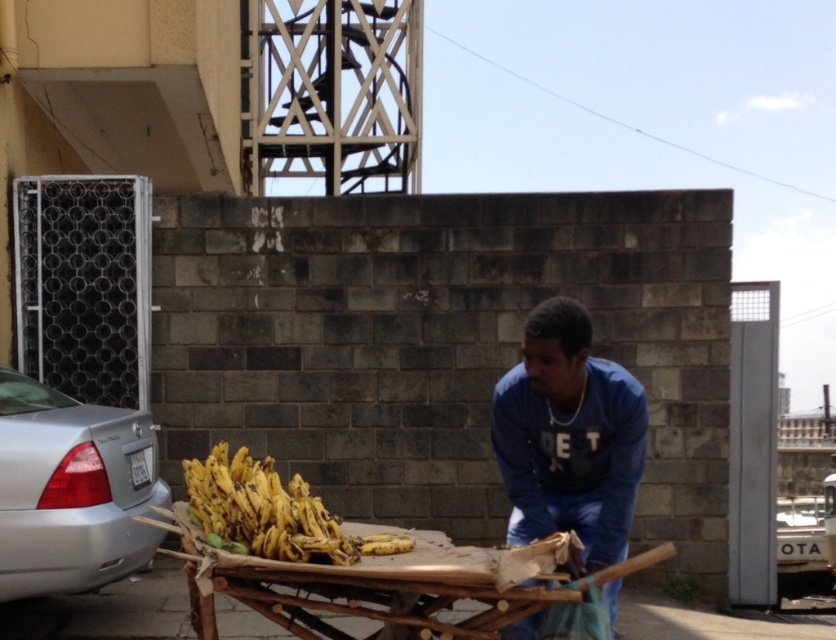
Can you confirm if silver metallic car at left is taller than yellow matte bananas at center?

Yes, silver metallic car at left is taller than yellow matte bananas at center.

Who is positioned more to the left, silver metallic car at left or yellow matte bananas at center?

silver metallic car at left is more to the left.

Which is behind, point (13, 435) or point (242, 532)?

Point (13, 435)

Where is `silver metallic car at left`? silver metallic car at left is located at coordinates (72, 490).

Does silver metallic car at left appear over wooden bamboo cart at center?

Yes, silver metallic car at left is above wooden bamboo cart at center.

Can you confirm if silver metallic car at left is thinner than wooden bamboo cart at center?

Yes.

Between point (83, 440) and point (427, 552), which one is positioned behind?

The point (83, 440) is more distant.

At what (x,y) coordinates should I click in order to perform the action: click on silver metallic car at left. Please return your answer as a coordinate pair (x, y). This screenshot has height=640, width=836. Looking at the image, I should click on (72, 490).

Based on the photo, is blue cotton shirt at center to the left of yellow matte bananas at lower center from the viewer's perspective?

No, blue cotton shirt at center is not to the left of yellow matte bananas at lower center.

Locate an element on the screen. The width and height of the screenshot is (836, 640). blue cotton shirt at center is located at coordinates (569, 438).